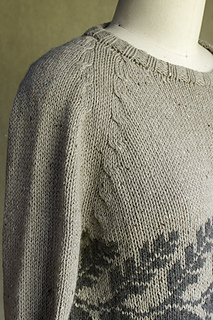
This screenshot has height=320, width=213. What are the coordinates of `mannequin` in the screenshot? It's located at (170, 21).